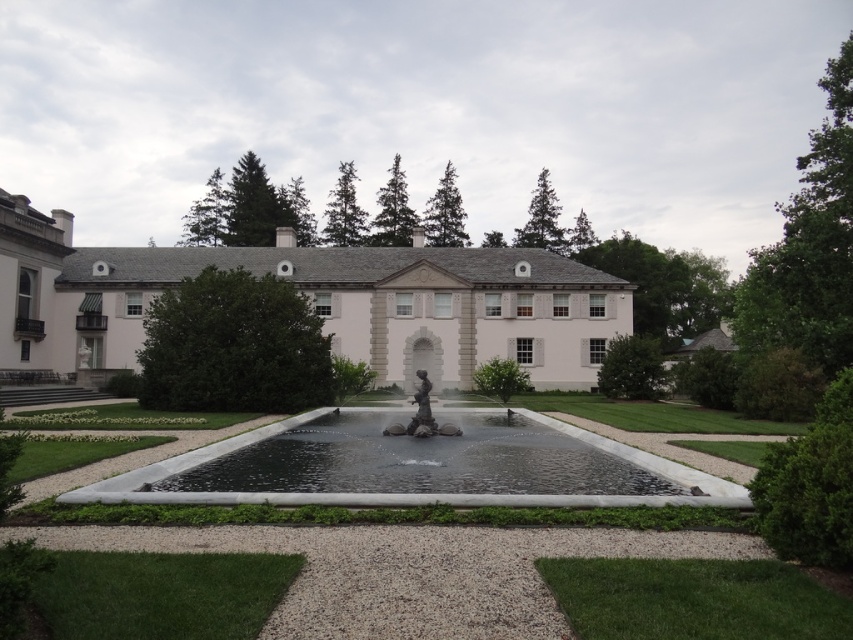
Is the position of white stone mansion at center more distant than that of clear glass water at center?

Yes.

Which is in front, point (71, 312) or point (180, 472)?

Positioned in front is point (180, 472).

At what (x,y) coordinates should I click in order to perform the action: click on white stone mansion at center. Please return your answer as a coordinate pair (x, y). The width and height of the screenshot is (853, 640). Looking at the image, I should click on (312, 301).